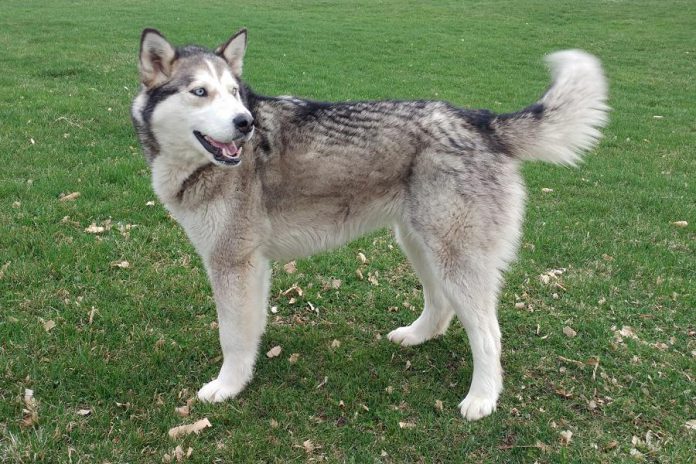
Image resolution: width=696 pixels, height=464 pixels. I want to click on left front leg, so click(x=237, y=325).